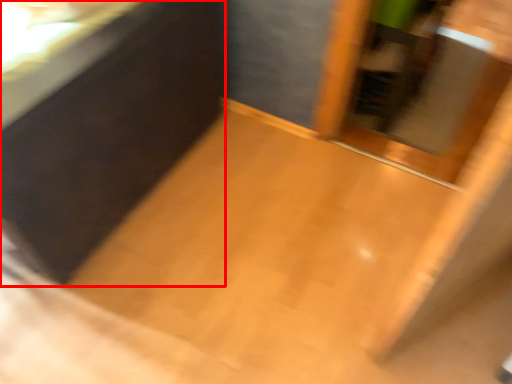
Question: Observing the image, what is the correct spatial positioning of vanity (annotated by the red box) in reference to screen door?

Choices:
 (A) left
 (B) right

Answer: (A)